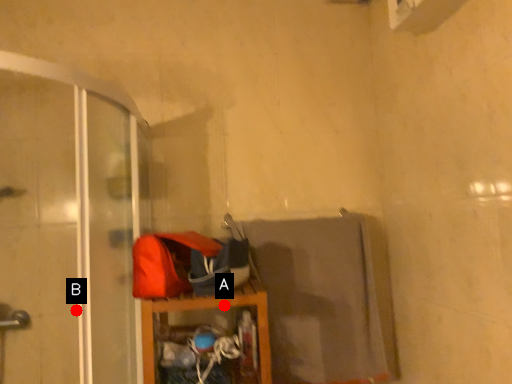
Question: Two points are circled on the image, labeled by A and B beside each circle. Which point appears farthest from the camera in this image?

Choices:
 (A) A is further
 (B) B is further

Answer: (B)